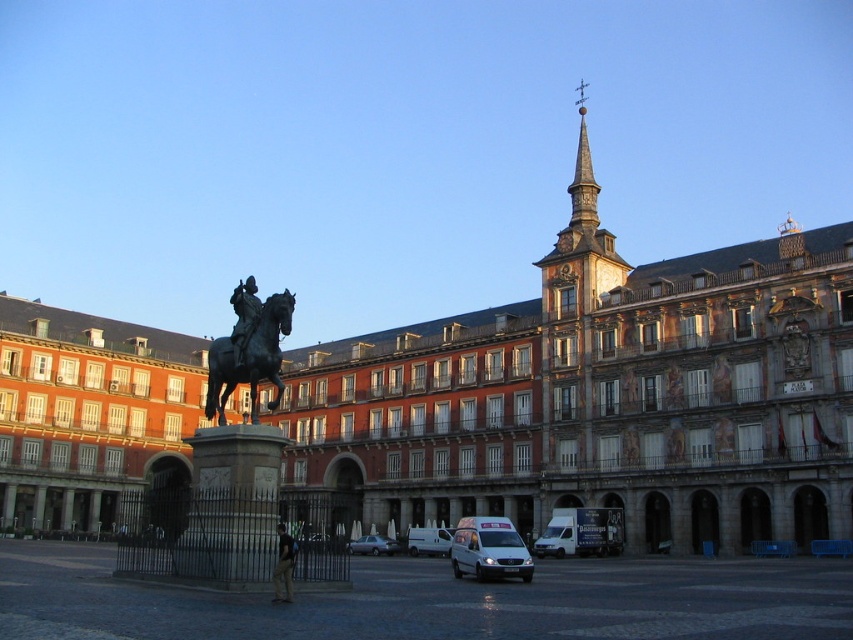
Between point (585, 349) and point (267, 301), which one is positioned in front?

Point (267, 301)

Between brown stone tower at upper center and shiny black horse at center, which one has less height?

shiny black horse at center

This screenshot has height=640, width=853. I want to click on brown stone tower at upper center, so click(582, 349).

You are a GUI agent. You are given a task and a screenshot of the screen. Output one action in this format:
    pyautogui.click(x=<x>, y=<y>)
    Task: Click on the brown stone tower at upper center
    This screenshot has width=853, height=640.
    Given the screenshot: What is the action you would take?
    pyautogui.click(x=582, y=349)

Between point (564, 308) and point (281, 573), which one is positioned in front?

Point (281, 573)

Find the location of a particular element. This screenshot has height=640, width=853. brown stone tower at upper center is located at coordinates (582, 349).

Does white matte van at lower center have a lesser height compared to metallic silver sedan at center?

In fact, white matte van at lower center may be taller than metallic silver sedan at center.

Can you confirm if white matte van at lower center is thinner than metallic silver sedan at center?

Indeed, white matte van at lower center has a lesser width compared to metallic silver sedan at center.

This screenshot has height=640, width=853. I want to click on white matte van at lower center, so click(x=489, y=548).